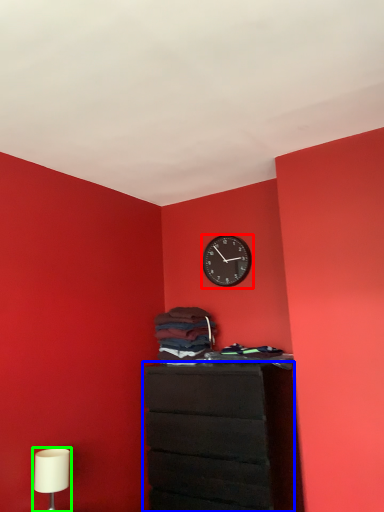
Question: Which object is the closest to the wall clock (highlighted by a red box)? Choose among these: chest of drawers (highlighted by a blue box) or table lamp (highlighted by a green box).

Choices:
 (A) chest of drawers
 (B) table lamp

Answer: (A)